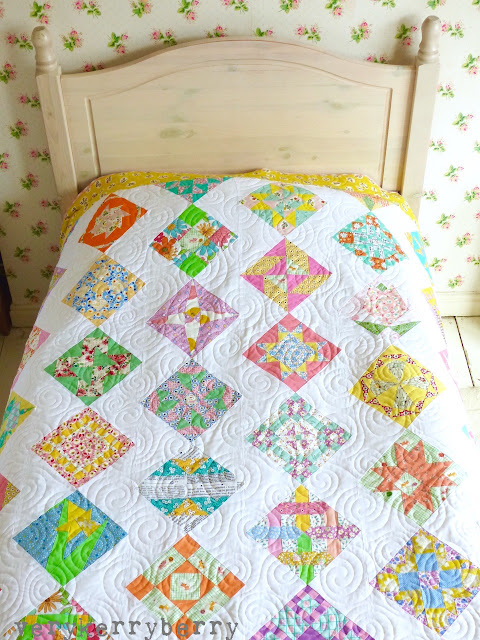
Identify the location of floor. The width and height of the screenshot is (480, 640). (464, 347), (21, 349).